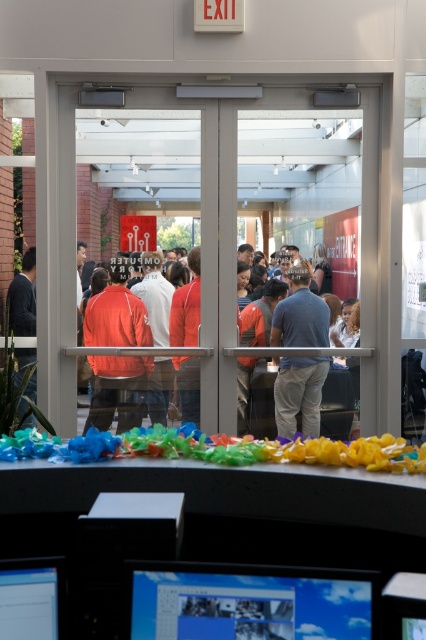
You are a technician who needs to connect a cable that is 16 inches long between the matte plastic monitor at lower center and the matte black monitor at lower left. Will the cable reach?

The distance between the matte plastic monitor at lower center and the matte black monitor at lower left is 15.73 inches. Since the cable is 16 inches long, it will reach comfortably.